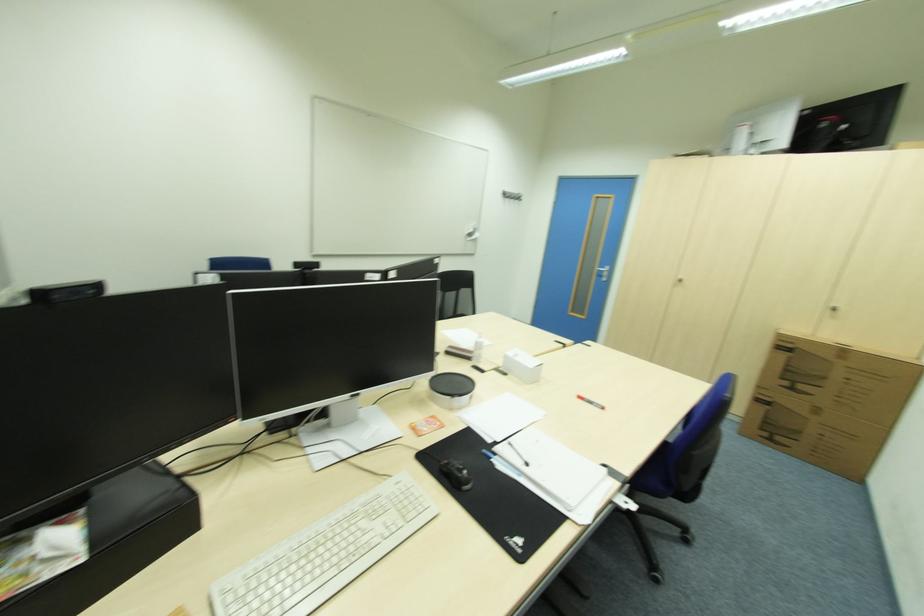
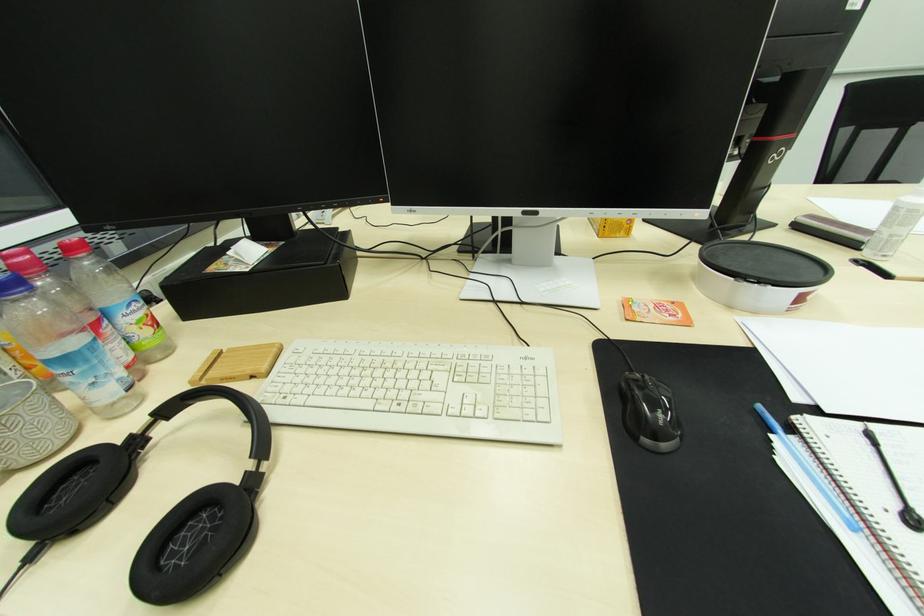
First-person continuous shooting, in which direction is the camera rotating?

The camera rotated toward left-down.